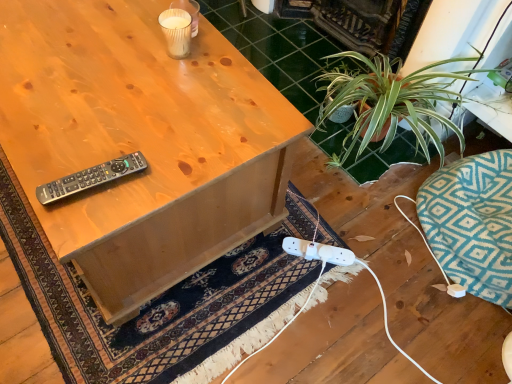
Find the location of a particular element. The height and width of the screenshot is (384, 512). vacant space positioned to the left of black plastic remote at upper left is located at coordinates (40, 155).